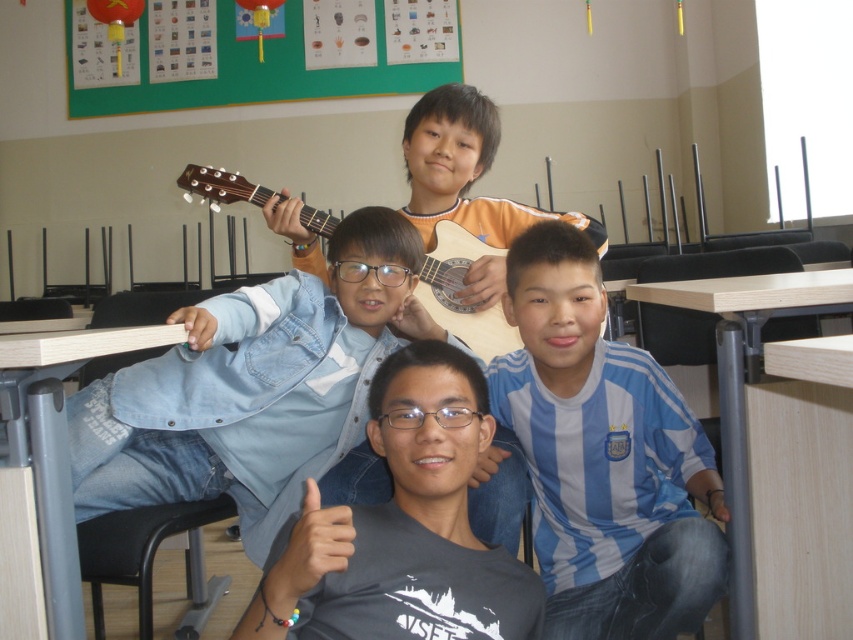
You are standing at the entrance of the classroom and want to locate the blue striped jersey at center. According to the coordinates given, where should you look to find it?

The blue striped jersey at center is located at coordinates point (602, 456), so you should look towards the lower right area of the image.